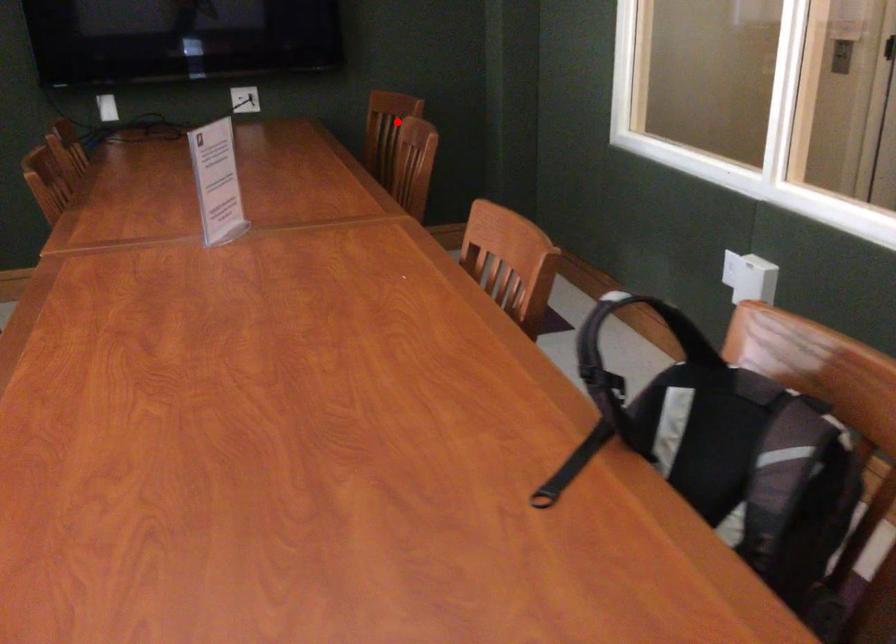
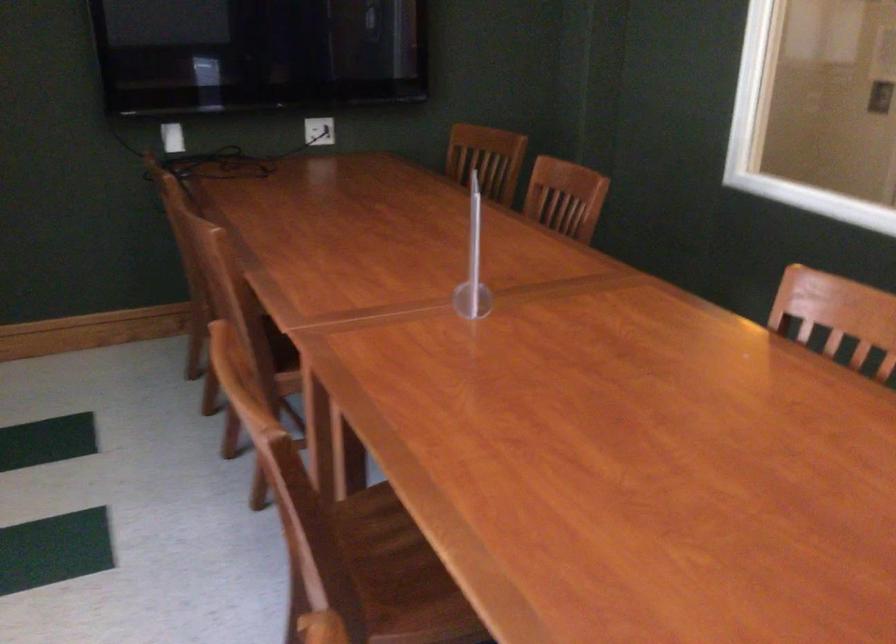
The point at the highlighted location is marked in the first image. Where is the corresponding point in the second image?

(487, 158)